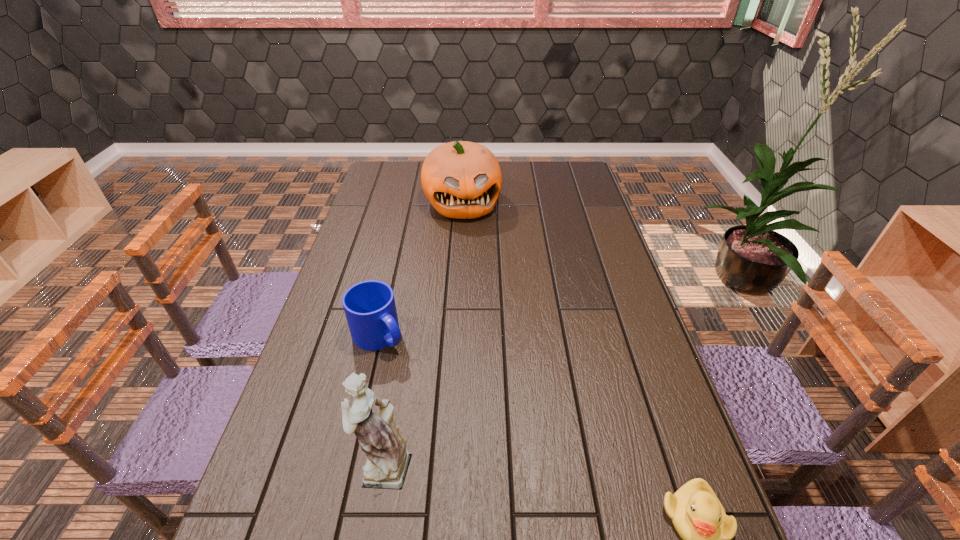
You are a GUI agent. You are given a task and a screenshot of the screen. Output one action in this format:
    pyautogui.click(x=<x>, y=<y>)
    Task: Click on the free space located 0.180m on the side with the handle of the mug
    The image size is (960, 540).
    Given the screenshot: What is the action you would take?
    pos(440,394)

At what (x,y) coordinates should I click in order to perform the action: click on vacant space located on the face of the pumpkin. Please return your answer as a coordinate pair (x, y). Looking at the image, I should click on (485, 280).

The height and width of the screenshot is (540, 960). Identify the location of vacant space located on the face of the pumpkin. (475, 249).

The height and width of the screenshot is (540, 960). Identify the location of free point located on the face of the pumpkin. (484, 278).

At what (x,y) coordinates should I click in order to perform the action: click on object present at the far edge. Please return your answer as a coordinate pair (x, y). Image resolution: width=960 pixels, height=540 pixels. Looking at the image, I should click on (462, 180).

Locate an element on the screen. object that is at the near edge is located at coordinates (387, 463).

Locate an element on the screen. The width and height of the screenshot is (960, 540). object located at the left edge is located at coordinates (369, 306).

Identify the location of free space at the far edge. The height and width of the screenshot is (540, 960). coord(517,161).

Find the location of a particular element. This screenshot has height=540, width=960. vacant space at the left edge of the desktop is located at coordinates (333, 300).

This screenshot has height=540, width=960. Identify the location of free space at the right edge of the desktop. (606, 379).